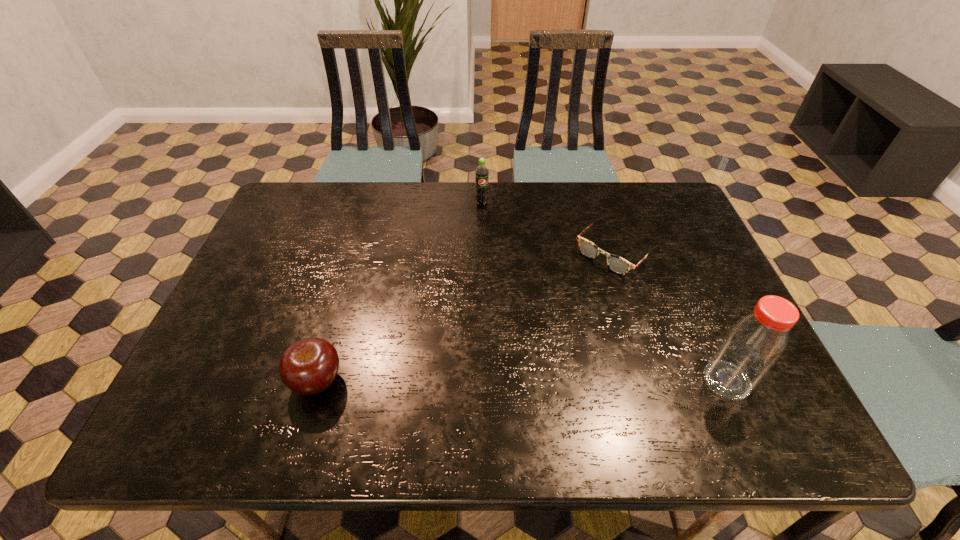
Identify the location of vacant area situated on the frame of the third nearest object. (553, 310).

At what (x,y) coordinates should I click in order to perform the action: click on free location located 0.130m on the frame of the third nearest object. Please return your answer as a coordinate pair (x, y). The image size is (960, 540). Looking at the image, I should click on (564, 300).

Where is `free spot located 0.320m on the front label of the farthest object`? This screenshot has width=960, height=540. free spot located 0.320m on the front label of the farthest object is located at coordinates (491, 280).

Image resolution: width=960 pixels, height=540 pixels. In order to click on vacant space located 0.380m on the front label of the farthest object in this screenshot , I will do `click(492, 298)`.

The image size is (960, 540). I want to click on free region located 0.260m on the front label of the farthest object, so click(x=489, y=265).

I want to click on spectacles located in the far edge section of the desktop, so click(x=617, y=264).

Identify the location of soda positioned at the far edge. The height and width of the screenshot is (540, 960). (481, 173).

Where is `apple present at the near edge`? apple present at the near edge is located at coordinates (309, 366).

Image resolution: width=960 pixels, height=540 pixels. I want to click on bottle situated at the near edge, so click(x=752, y=346).

Locate an element on the screen. This screenshot has width=960, height=540. bottle positioned at the right edge is located at coordinates (752, 346).